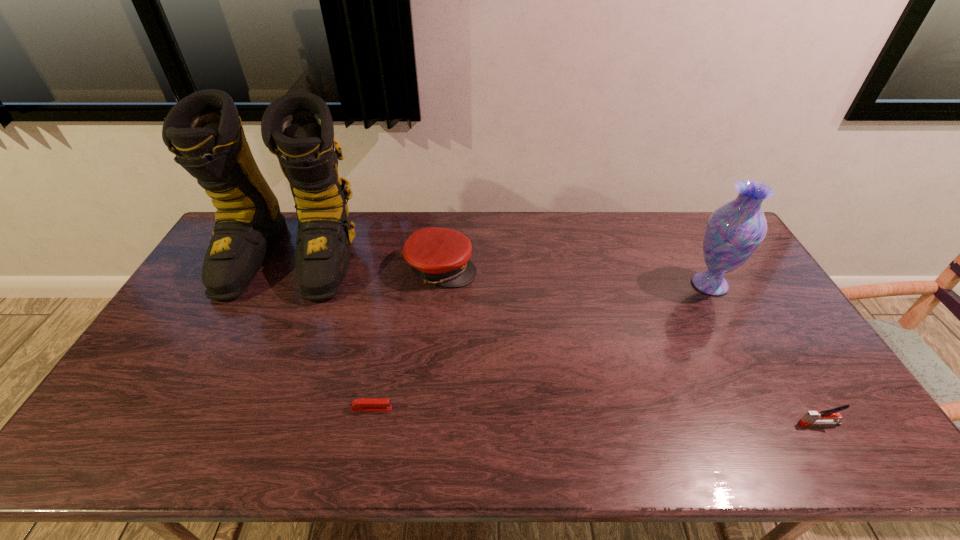
What are the coordinates of `the tallest object` in the screenshot? It's located at (204, 131).

The image size is (960, 540). In order to click on the leftmost object in this screenshot , I will do `click(204, 131)`.

Locate an element on the screen. The height and width of the screenshot is (540, 960). vase is located at coordinates (734, 231).

The height and width of the screenshot is (540, 960). Identify the location of cap. (441, 256).

Locate an element on the screen. the nearest object is located at coordinates (828, 417).

You are a GUI agent. You are given a task and a screenshot of the screen. Output one action in this format:
    pyautogui.click(x=<x>, y=<y>)
    Task: Click on the second shortest object
    This screenshot has width=960, height=540.
    Given the screenshot: What is the action you would take?
    pyautogui.click(x=828, y=417)

You are a GUI agent. You are given a task and a screenshot of the screen. Output one action in this format:
    pyautogui.click(x=<x>, y=<y>)
    Task: Click on the left stapler
    
    Given the screenshot: What is the action you would take?
    pyautogui.click(x=363, y=404)

The width and height of the screenshot is (960, 540). Find the location of `the farther stapler`. the farther stapler is located at coordinates (363, 404).

Identify the location of vacant area located on the front of the tallest object. (221, 402).

Locate an element on the screen. The height and width of the screenshot is (540, 960). free space located 0.260m on the front of the second tallest object is located at coordinates (756, 370).